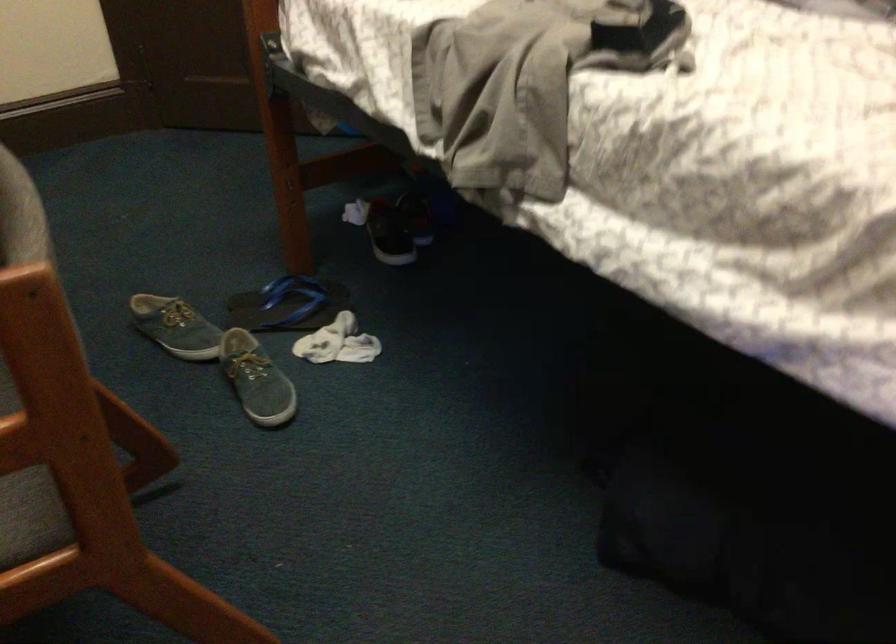
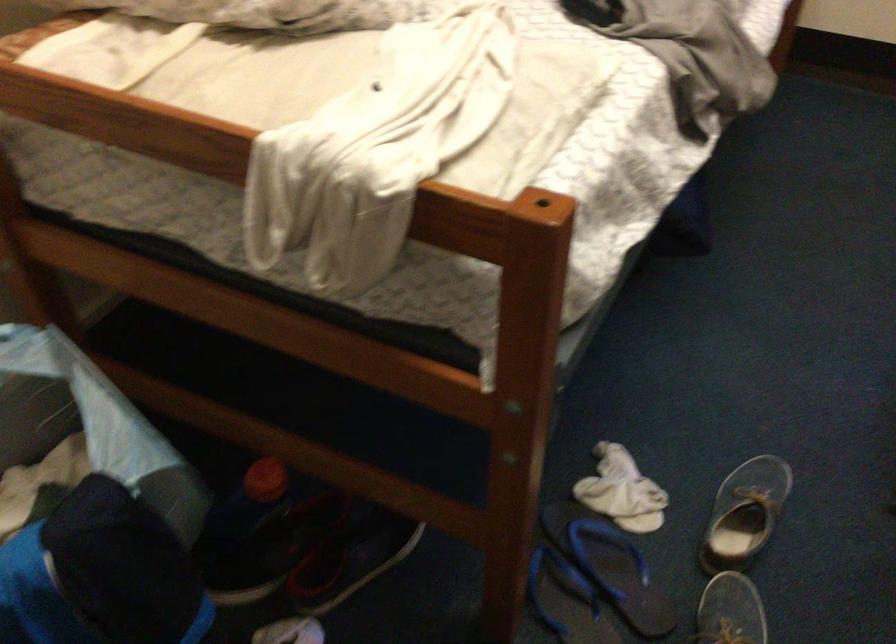
Locate, in the second image, the point that corresponds to pixel 287 321 in the first image.

(609, 565)